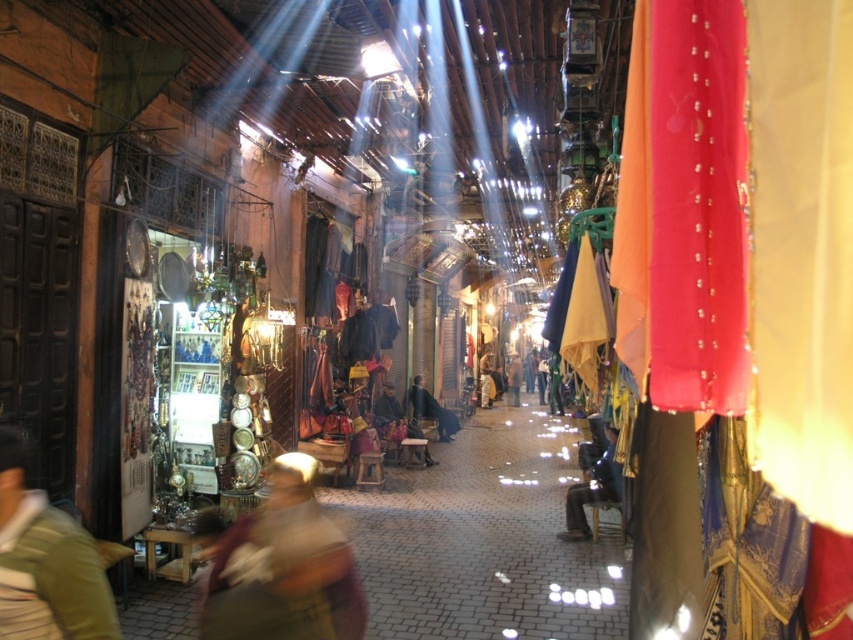
You are a traveler standing at the entrance of the shop with a dark wooden door. You see a green fabric headscarf at center and a dark brown leather jacket at center. Which item is closer to the ceiling beams of the alley?

The green fabric headscarf at center is shorter than the dark brown leather jacket at center, so the dark brown leather jacket at center is closer to the ceiling beams of the alley.

You are standing in the market alleyway and want to reach a specific point. Which of the two points, point 1 at coordinates (393, 426) or point 2 at coordinates (415, 396), is closer to you?

Point 1 at coordinates (393, 426) is closer to you than point 2 at coordinates (415, 396).

You are standing in the market alleyway and want to reach a point closer to you. Which of the two points, point (230, 584) or point (456, 420), should you head towards?

You should head towards point (230, 584) because it is closer to the viewer than point (456, 420).